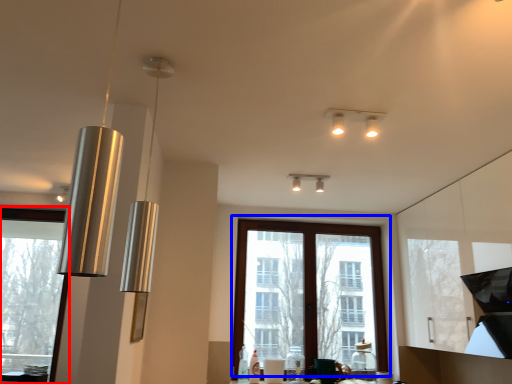
Question: Which object is further to the camera taking this photo, window (highlighted by a red box) or window (highlighted by a blue box)?

Choices:
 (A) window
 (B) window

Answer: (B)